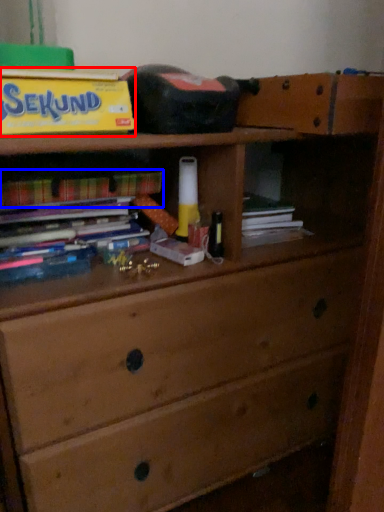
Question: Which of the following is the farthest to the observer, paperback book (highlighted by a red box) or book (highlighted by a blue box)?

Choices:
 (A) paperback book
 (B) book

Answer: (B)